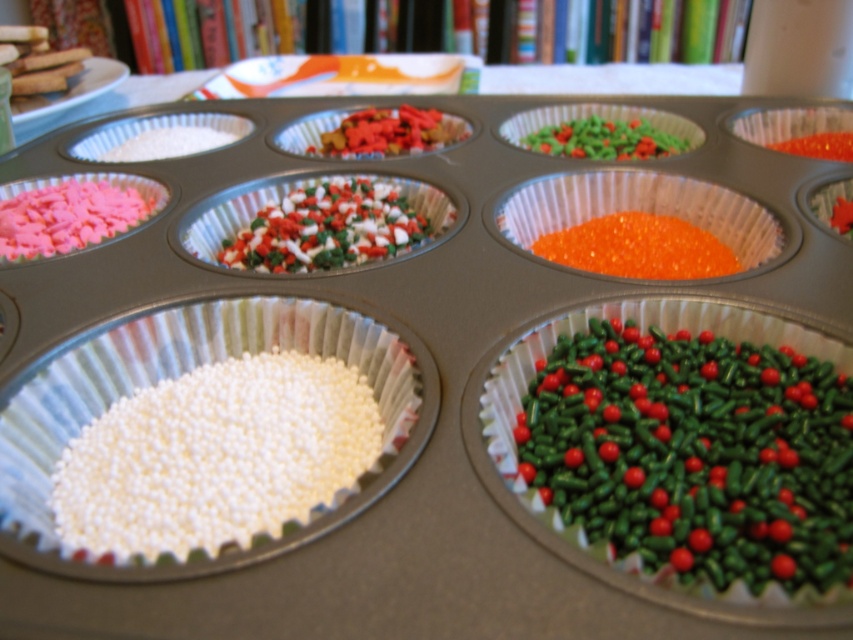
You are a baker preparing a cupcake decoration. You have two types of sprinkles available in the muffin tin at center. The multicolored sprinkles at center and the orange glossy sprinkles at center. Which one is bigger in size?

The multicolored sprinkles at center are larger in size compared to the orange glossy sprinkles at center.

You are a chef preparing a cake and need to place sprinkles in specific positions. You have two points marked on the muffin tin at coordinates point (779, 474) and point (387, 394). Which point is closer to you when you are standing in front of the muffin tin?

Point (779, 474) is closer to the viewer than point (387, 394), so the point closer to you is point (779, 474).